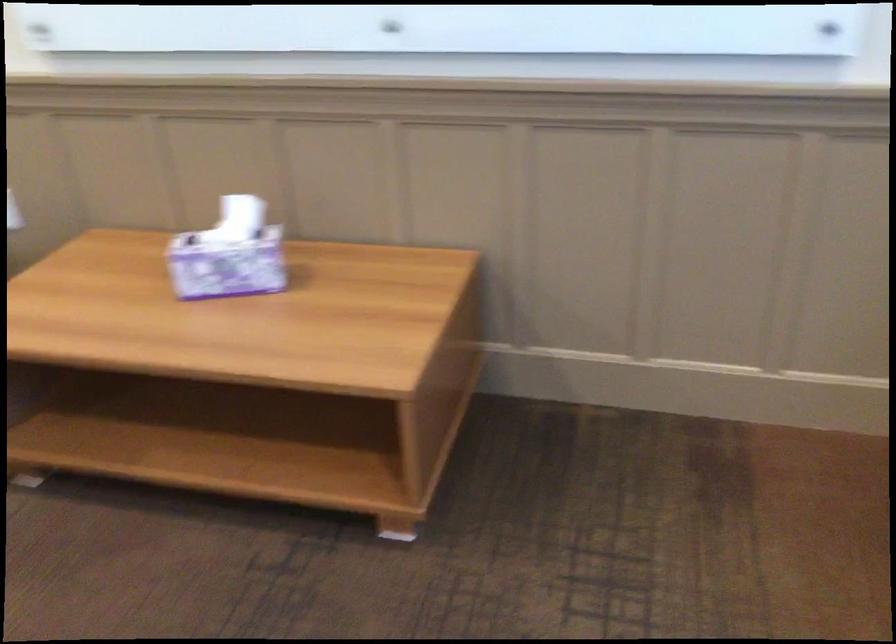
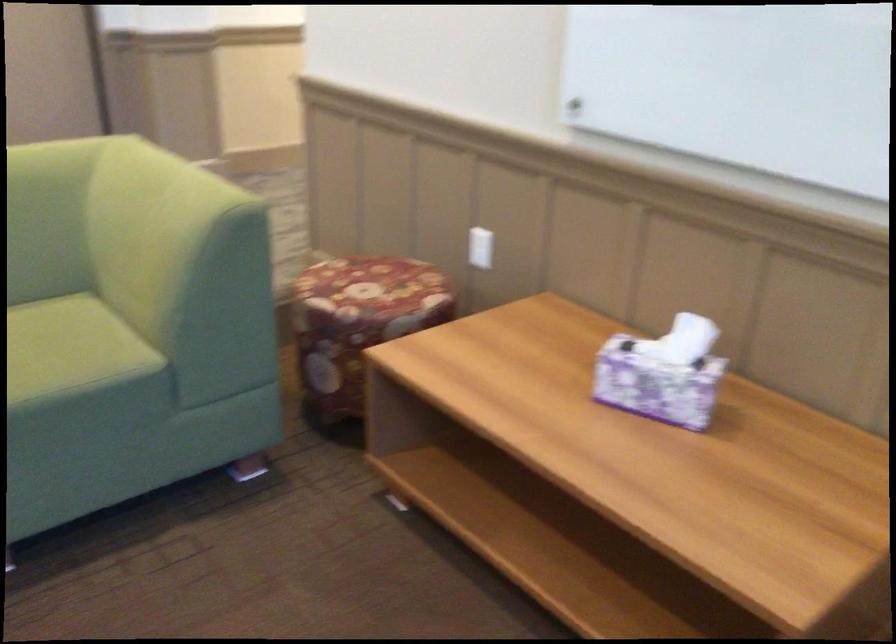
In the second image, find the point that corresponds to the point at 244,223 in the first image.

(690, 341)